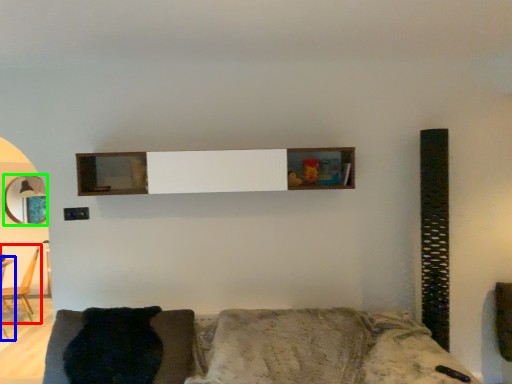
Question: Estimate the real-world distances between objects in this image. Which object is farther from chair (highlighted by a red box), table (highlighted by a blue box) or mirror (highlighted by a green box)?

Choices:
 (A) table
 (B) mirror

Answer: (B)